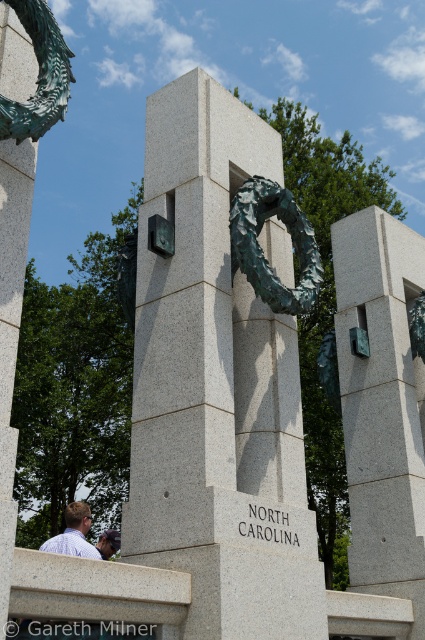
You are a visitor standing in front of the monument. You notice the gray granite column at center and the green patina wreath at center. Which object is closer to you?

The gray granite column at center is closer to you since it is in front of the green patina wreath at center.

You are a photographer setting up a shot of the monument. You have a matte gray stone at center and a light blue shirt at lower left in your frame. Which object is narrower in your photo?

The matte gray stone at center is narrower than the light blue shirt at lower left.